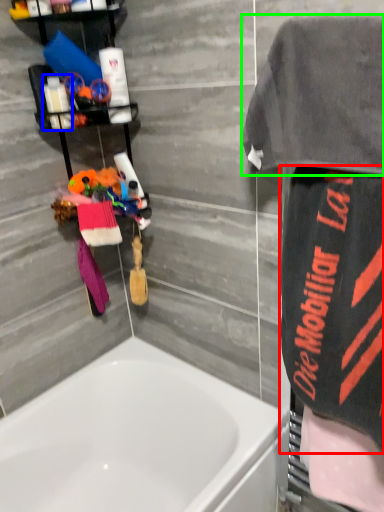
Question: Considering the real-world distances, which object is closest to beach towel (highlighted by a red box)? toiletry (highlighted by a blue box) or beach towel (highlighted by a green box).

Choices:
 (A) toiletry
 (B) beach towel

Answer: (B)